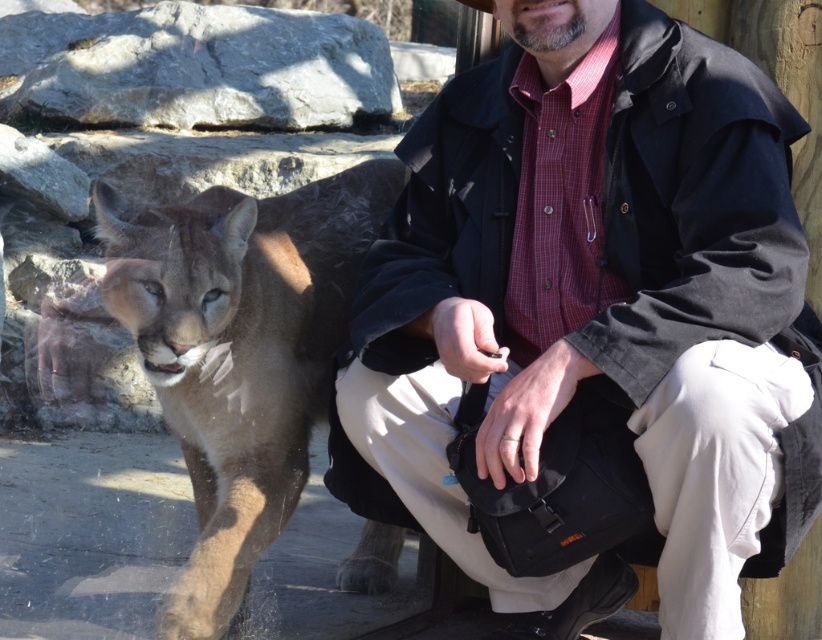
Who is lower down, matte black jacket at center or brown fur cougar at left?

matte black jacket at center

Does matte black jacket at center have a lesser height compared to brown fur cougar at left?

Incorrect, matte black jacket at center's height does not fall short of brown fur cougar at left's.

Is point (730, 132) behind point (234, 312)?

No, it is not.

I want to click on matte black jacket at center, so click(x=594, y=308).